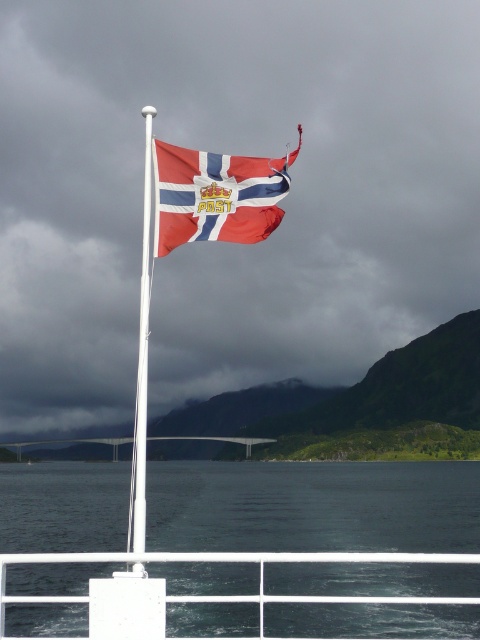
Can you confirm if matte fabric flag at center is positioned to the right of white metallic flag pole at upper center?

Correct, you'll find matte fabric flag at center to the right of white metallic flag pole at upper center.

Between matte fabric flag at center and white metallic flag pole at upper center, which one is positioned higher?

Positioned higher is matte fabric flag at center.

Where is `matte fabric flag at center`? The image size is (480, 640). matte fabric flag at center is located at coordinates 216,195.

Is point (10, 541) farther from viewer compared to point (170, 208)?

Yes, it is.

Who is more forward, (297,579) or (192,230)?

Point (192,230) is in front.

This screenshot has width=480, height=640. I want to click on dark blue water at center, so click(313, 506).

Can you confirm if dark blue water at center is taller than white metallic flag pole at upper center?

Correct, dark blue water at center is much taller as white metallic flag pole at upper center.

Consider the image. Can you confirm if dark blue water at center is bigger than white metallic flag pole at upper center?

Yes.

Which is behind, point (448, 582) or point (145, 417)?

The point (448, 582) is more distant.

At what (x,y) coordinates should I click in order to perform the action: click on dark blue water at center. Please return your answer as a coordinate pair (x, y). The image size is (480, 640). Looking at the image, I should click on (313, 506).